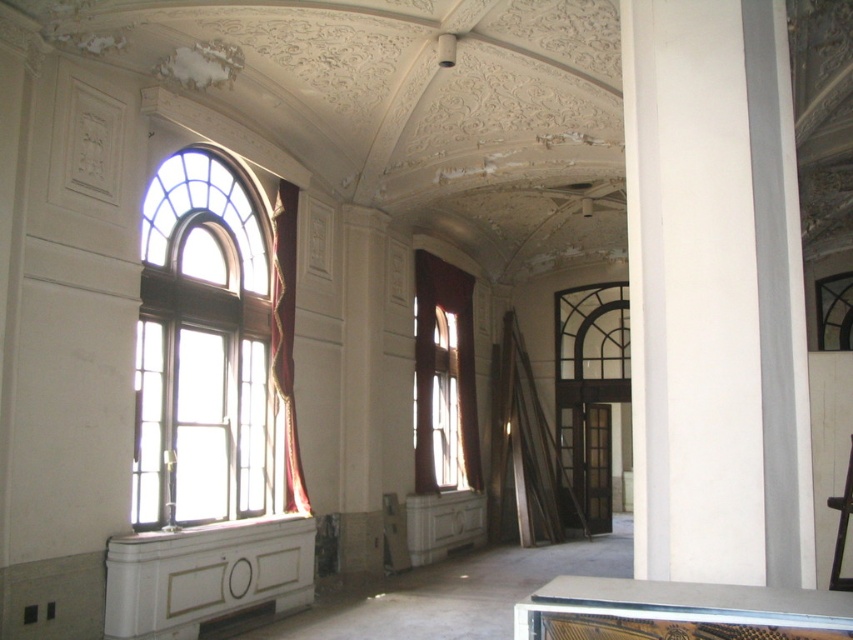
Question: Observing the image, what is the correct spatial positioning of white smooth pillar at center in reference to matte red curtain at center?

Choices:
 (A) above
 (B) below

Answer: (A)

Question: Estimate the real-world distances between objects in this image. Which object is closer to the white smooth pillar at center?

Choices:
 (A) velvet red curtain at left
 (B) matte red curtain at center

Answer: (A)

Question: Which of the following is the farthest from the observer?

Choices:
 (A) velvet red curtain at left
 (B) clear glass window at left
 (C) matte red curtain at center
 (D) white smooth pillar at center

Answer: (C)

Question: Is clear glass window at left to the right of matte red curtain at center from the viewer's perspective?

Choices:
 (A) no
 (B) yes

Answer: (A)

Question: Which point is closer to the camera?

Choices:
 (A) matte red curtain at center
 (B) velvet red curtain at left

Answer: (B)

Question: Is clear glass window at left smaller than velvet red curtain at left?

Choices:
 (A) no
 (B) yes

Answer: (A)